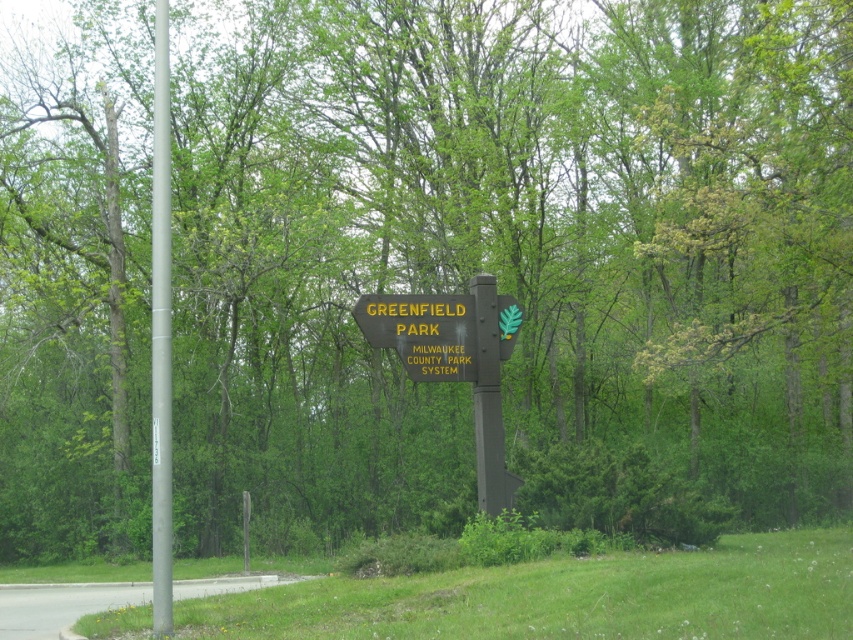
Who is positioned more to the left, wooden sign at center or black metal signpost at center?

wooden sign at center is more to the left.

Is wooden sign at center to the right of black metal signpost at center from the viewer's perspective?

In fact, wooden sign at center is to the left of black metal signpost at center.

Who is more distant from viewer, (515, 324) or (502, 464)?

The point (515, 324) is behind.

Find the location of a particular element. wooden sign at center is located at coordinates (422, 332).

Does wooden signboard at center have a smaller size compared to black metal signpost at center?

No, wooden signboard at center is not smaller than black metal signpost at center.

Is point (473, 368) closer to camera compared to point (492, 452)?

No.

At what (x,y) coordinates should I click in order to perform the action: click on wooden signboard at center. Please return your answer as a coordinate pair (x, y). The image size is (853, 640). Looking at the image, I should click on (456, 360).

Is point (161, 593) behind point (462, 321)?

No, it is not.

This screenshot has width=853, height=640. Identify the location of silver metallic pole at left. (161, 337).

Between point (157, 515) and point (434, 340), which one is positioned in front?

Point (157, 515) is more forward.

The image size is (853, 640). I want to click on silver metallic pole at left, so click(161, 337).